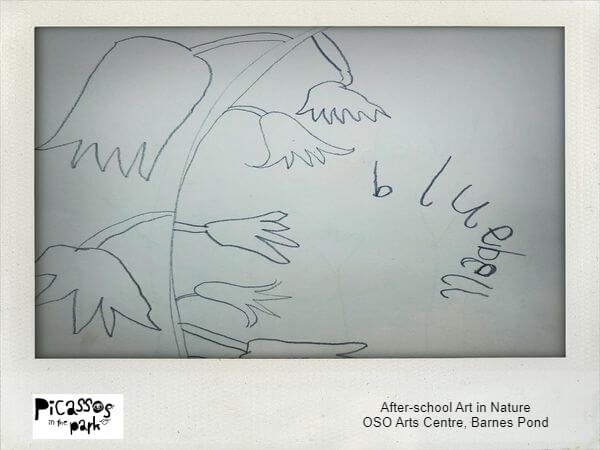
You are a GUI agent. You are given a task and a screenshot of the screen. Output one action in this format:
    pyautogui.click(x=<x>, y=<y>)
    Task: Click on the art
    
    Given the screenshot: What is the action you would take?
    pyautogui.click(x=465, y=394)